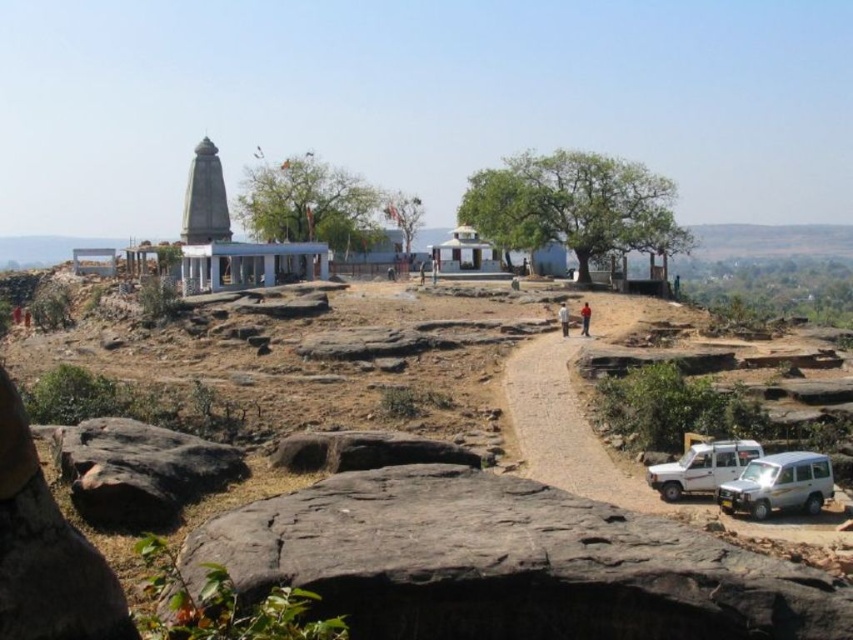
Does brown rough rock at center have a lesser width compared to brown fabric shirt at upper center?

No.

Who is more distant from viewer, (x=395, y=435) or (x=563, y=314)?

The point (x=563, y=314) is more distant.

Which is in front, point (299, 442) or point (564, 326)?

Positioned in front is point (299, 442).

At what (x,y) coordinates should I click in order to perform the action: click on brown rough rock at center. Please return your answer as a coordinate pair (x, y). The width and height of the screenshot is (853, 640). Looking at the image, I should click on (364, 451).

Who is taller, brown fabric shirt at upper center or brown leather jacket at center?

brown fabric shirt at upper center

Is point (558, 310) positioned before point (589, 333)?

No, (558, 310) is further to viewer.

Image resolution: width=853 pixels, height=640 pixels. Identify the location of brown fabric shirt at upper center. pyautogui.click(x=563, y=317).

Between dark gray rock at lower center and black rough rock at lower left, which one appears on the right side from the viewer's perspective?

From the viewer's perspective, dark gray rock at lower center appears more on the right side.

Is dark gray rock at lower center to the left of black rough rock at lower left from the viewer's perspective?

No, dark gray rock at lower center is not to the left of black rough rock at lower left.

The width and height of the screenshot is (853, 640). Describe the element at coordinates (508, 563) in the screenshot. I see `dark gray rock at lower center` at that location.

Where is `dark gray rock at lower center`? dark gray rock at lower center is located at coordinates (508, 563).